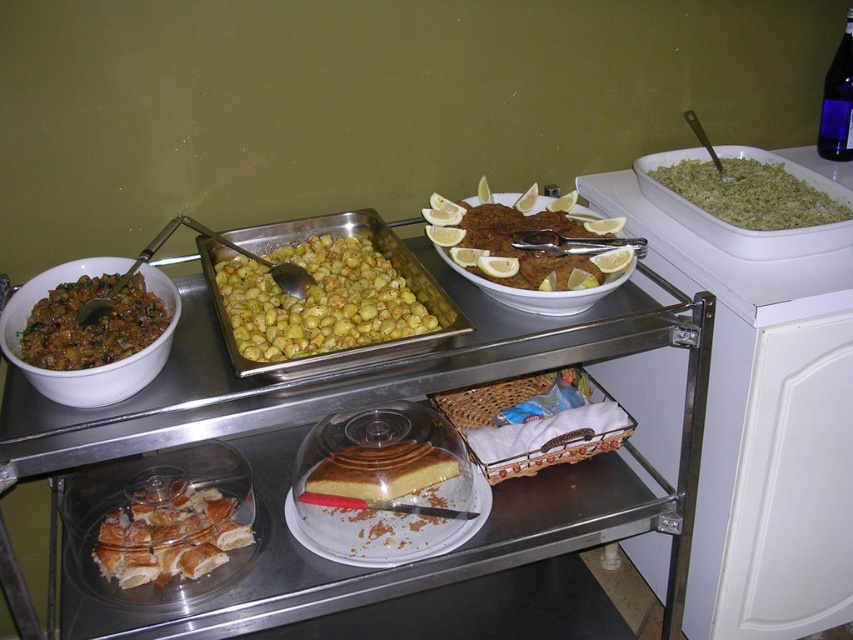
What is the location of the point with coordinates (751,193) in the image?

The point with coordinates (751,193) is located on the green rice at upper right.

You are arranging a buffet and need to place a rectangular metal tray that is 15 cm wide. The tray needs to fit between the green rice at upper right and the yellow sponge cake at center. Can you determine if there is enough space between them?

The green rice at upper right might be wider than the yellow sponge cake at center, so the space between them may vary. However, since the tray is 15 cm wide, you should measure the actual distance to ensure it fits properly.